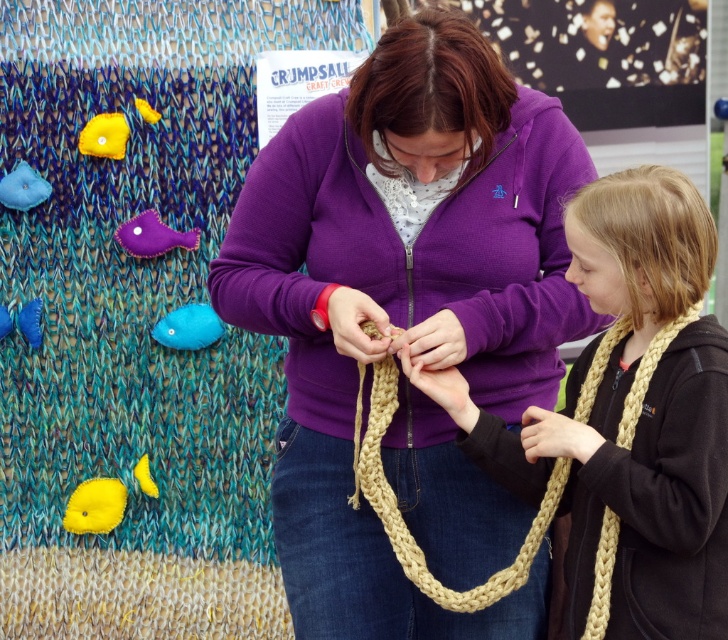
Can you confirm if matte yellow felt fish at lower left is wider than matte blue felt fish at upper left?

Correct, the width of matte yellow felt fish at lower left exceeds that of matte blue felt fish at upper left.

Between point (76, 486) and point (15, 195), which one is positioned in front?

Point (15, 195) is more forward.

Identify the location of matte yellow felt fish at lower left. The height and width of the screenshot is (640, 728). (95, 506).

Does matte blue felt fish at upper left lie behind blue felt fish at upper left?

No, it is in front of blue felt fish at upper left.

Which is more to the right, matte blue felt fish at upper left or blue felt fish at upper left?

Answer: Positioned to the right is matte blue felt fish at upper left.

Does point (1, 188) lie in front of point (0, 330)?

That is True.

This screenshot has height=640, width=728. Identify the location of matte blue felt fish at upper left. (23, 188).

Describe the element at coordinates (657, 496) in the screenshot. The width and height of the screenshot is (728, 640). I see `black fleece jacket at lower right` at that location.

Who is more distant from viewer, (510,445) or (146,100)?

Positioned behind is point (146,100).

The image size is (728, 640). Find the location of `black fleece jacket at lower right`. black fleece jacket at lower right is located at coordinates (657, 496).